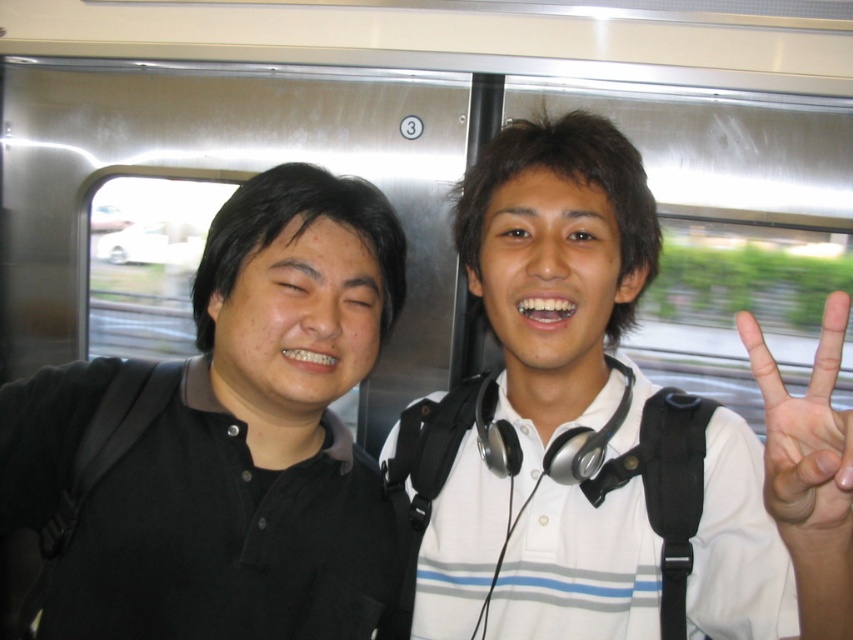
Based on the scene description, can you determine if the white matte shirt at center is wider than the black matte shirt at left?

The white matte shirt at center might be wider than black matte shirt at left according to the description.

Based on the scene description, where is the white matte shirt at center located in terms of coordinates?

The white matte shirt at center is located at coordinates point (607, 436).

You are standing in the train compartment and want to take a photo of both the point at coordinates point (320, 531) and point (753, 356). Since you can only focus on one point at a time, which point should you focus on to ensure the other is also in focus?

You should focus on point 0.559, 0885 because it is closer to the camera than point (320, 531). By focusing on the closer point, the depth of field may include the farther point in acceptable focus.